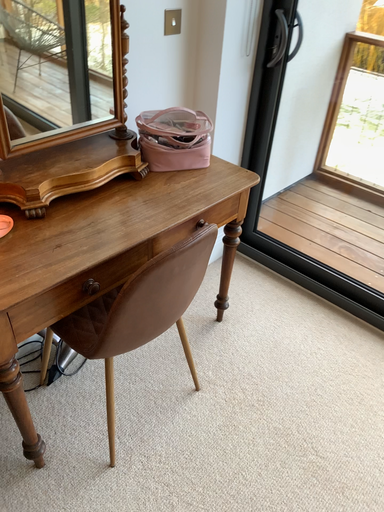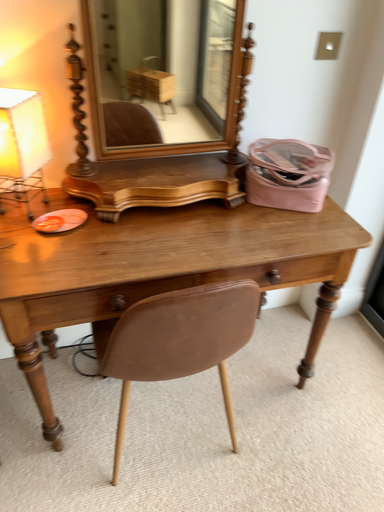
Question: How did the camera likely rotate when shooting the video?

Choices:
 (A) rotated left
 (B) rotated right

Answer: (A)